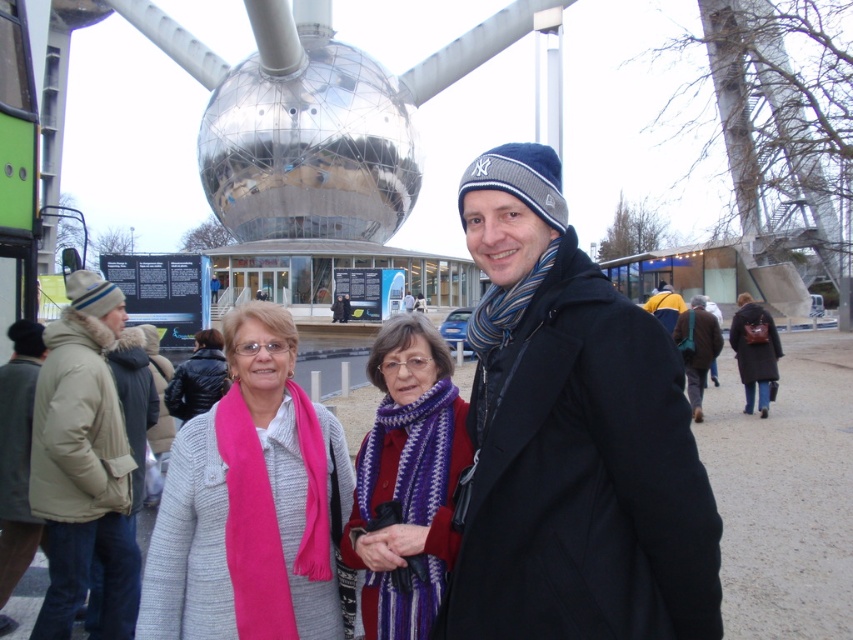
Based on the photo, you are a photographer trying to frame a shot that includes both the dark blue woolen coat at center and the matte pink scarf at center. Which object should you adjust your camera angle to prioritize if you want to capture the wider one in the scene?

The dark blue woolen coat at center is wider than the matte pink scarf at center, so you should prioritize capturing the dark blue woolen coat at center to include the wider object in your frame.

You are standing in front of the metallic spherical structure and notice the knitted scarf at center. Which direction should you move to get closer to the scarf?

The knitted scarf at center is located at point (407, 477), so you should move towards the center of the image to get closer to it.